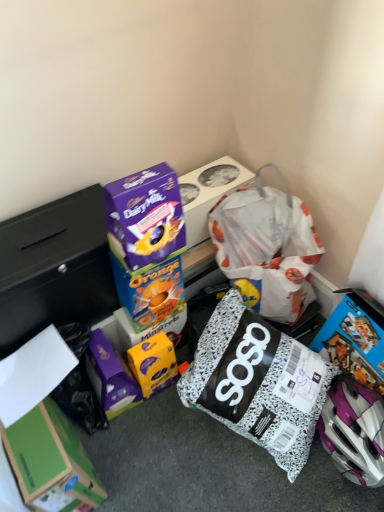
Question: Looking at the image, does blue cardboard box at center, the 3th box ordered from the bottom, seem bigger or smaller compared to purple cardboard dairy milk chocolate bar at upper center, the fifth box in the bottom-to-top sequence?

Choices:
 (A) big
 (B) small

Answer: (B)

Question: From a real-world perspective, is blue cardboard box at center, which appears as the third box when viewed from the top, physically located above or below purple cardboard dairy milk chocolate bar at upper center, the fifth box in the bottom-to-top sequence?

Choices:
 (A) above
 (B) below

Answer: (A)

Question: Considering the real-world distances, which object is farthest from the blue cardboard box at center, which appears as the third box when viewed from the top?

Choices:
 (A) white matte paper at lower left
 (B) purple glossy chocolate bar at upper center, positioned as the fourth box in bottom-to-top order
 (C) speckled fabric diaper bag at center
 (D) yellow matte chocolate bar at center, which is the fourth box from top to bottom
 (E) green cardboard box at lower left, which ranks as the 5th box in top-to-bottom order

Answer: (E)

Question: Which object is the closest to the white matte paper at lower left?

Choices:
 (A) purple glossy chocolate bar at upper center, positioned as the fourth box in bottom-to-top order
 (B) green cardboard box at lower left, which ranks as the 5th box in top-to-bottom order
 (C) speckled fabric diaper bag at center
 (D) blue cardboard box at center, which appears as the third box when viewed from the top
 (E) purple cardboard dairy milk chocolate bar at upper center, the fifth box in the bottom-to-top sequence

Answer: (B)